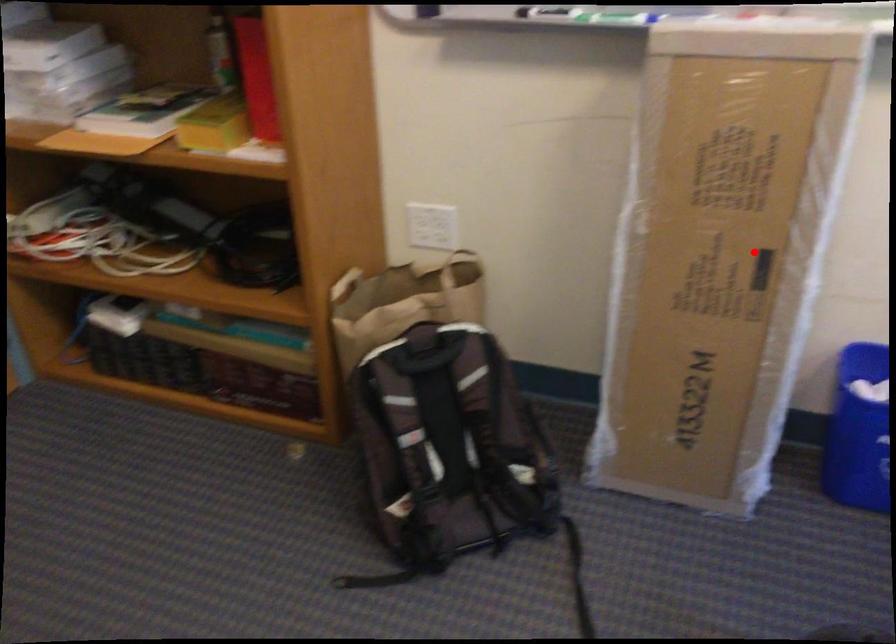
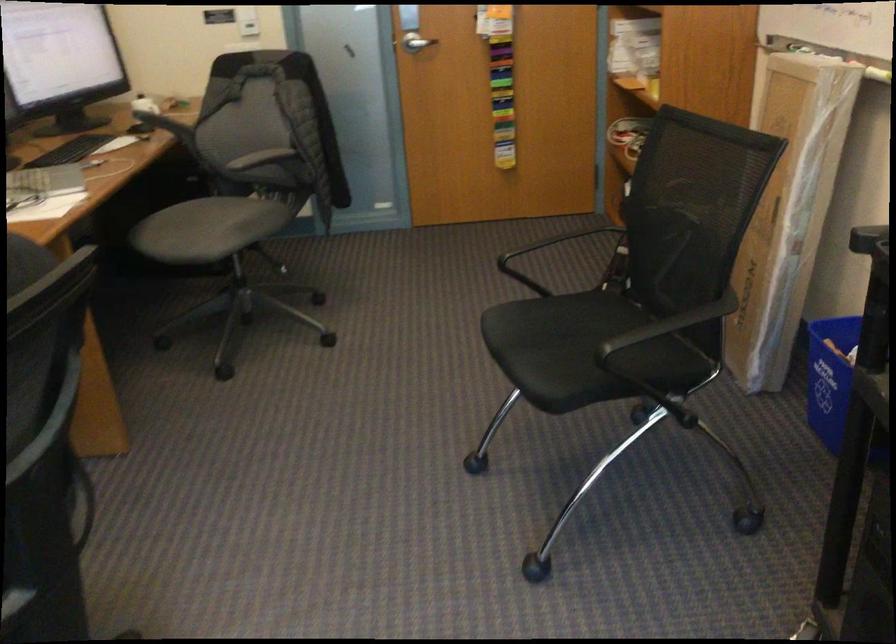
Where in the second image is the point corresponding to the highlighted location from the first image?

(788, 212)